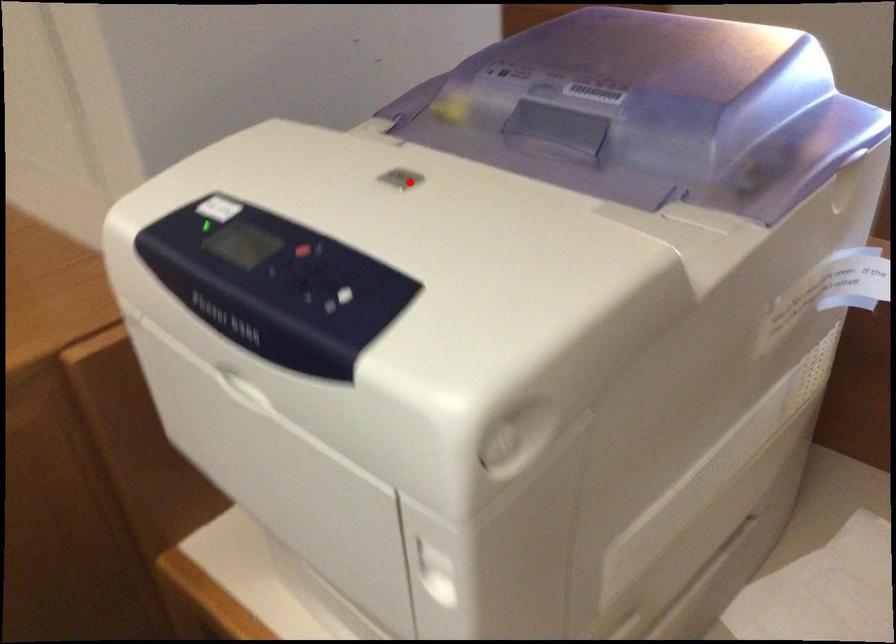
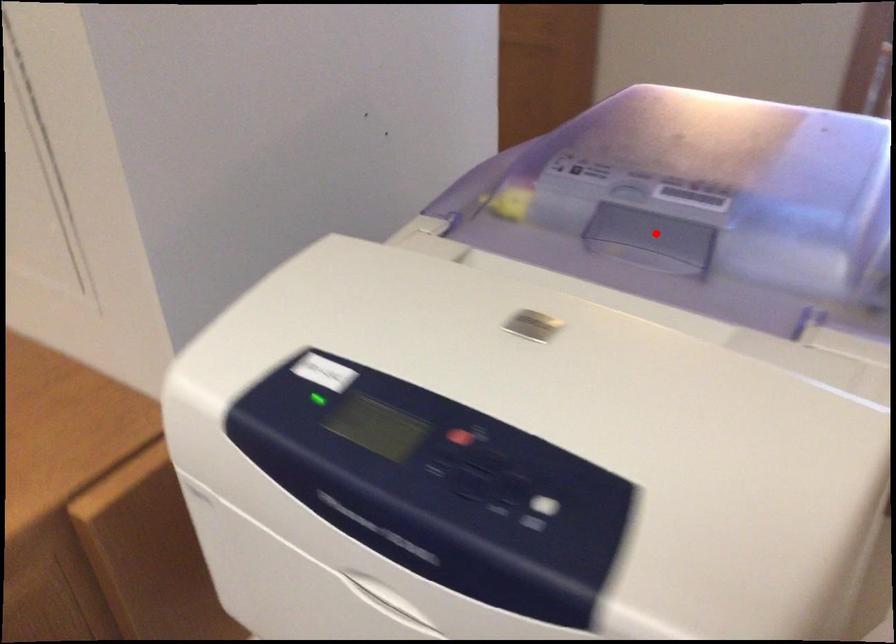
I am providing you with two images of the same scene from different viewpoints. A red point is marked on the first image and another point is marked on the second image. Are the points marked in image1 and image2 representing the same 3D position?

No